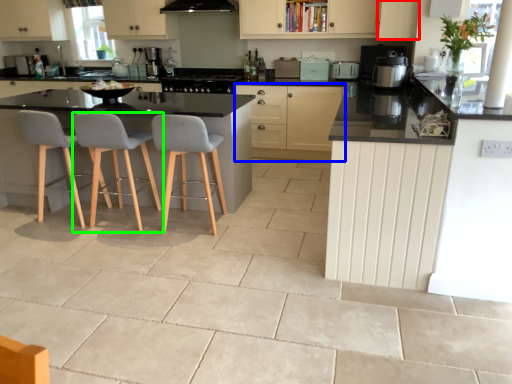
Question: Which object is the farthest from cabinetry (highlighted by a red box)? Choose among these: cabinetry (highlighted by a blue box) or chair (highlighted by a green box).

Choices:
 (A) cabinetry
 (B) chair

Answer: (B)